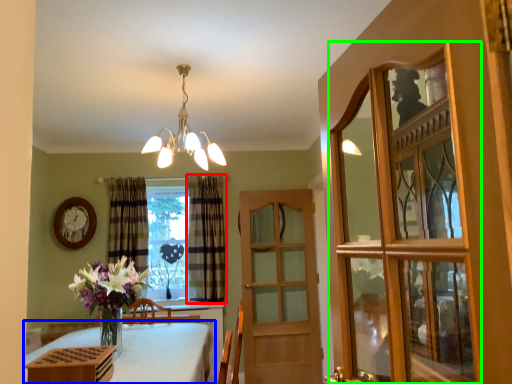
Question: Which object is positioned farthest from curtain (highlighted by a red box)? Select from table (highlighted by a blue box) and glass door (highlighted by a green box).

Choices:
 (A) table
 (B) glass door

Answer: (B)